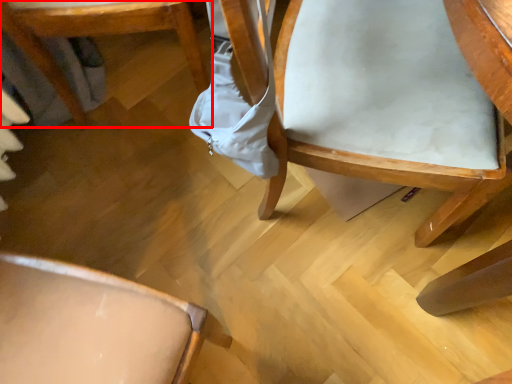
Question: From the image's perspective, considering the relative positions of chair (annotated by the red box) and chair in the image provided, where is chair (annotated by the red box) located with respect to the staircase?

Choices:
 (A) below
 (B) above

Answer: (B)